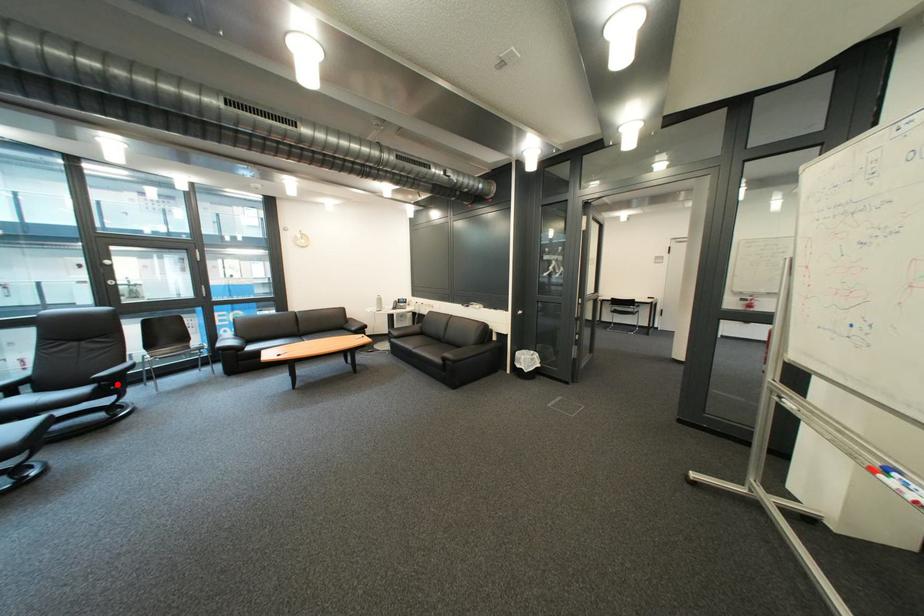
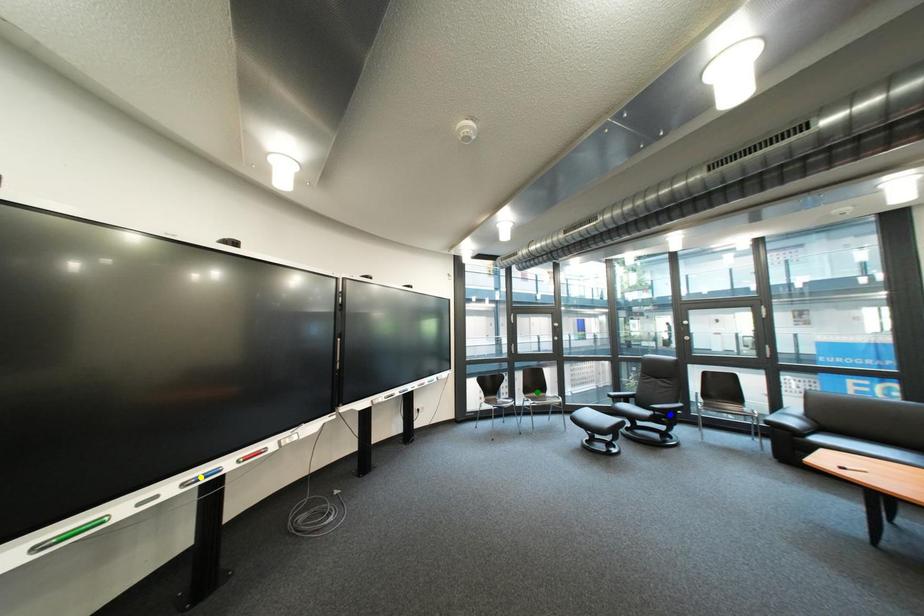
Question: I am providing you with two images of the same scene from different viewpoints. A red point is marked on the first image. You are given multiple points on the second image. Which point in image 2 represents the same 3d spot as the red point in image 1?

Choices:
 (A) blue point
 (B) yellow point
 (C) green point

Answer: (A)